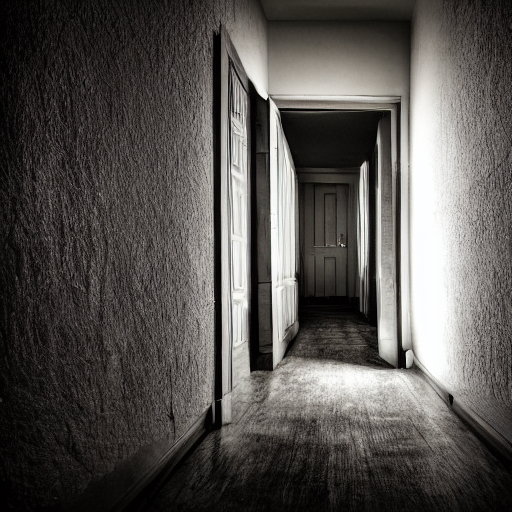
I want to click on textured wall, so tap(75, 277).